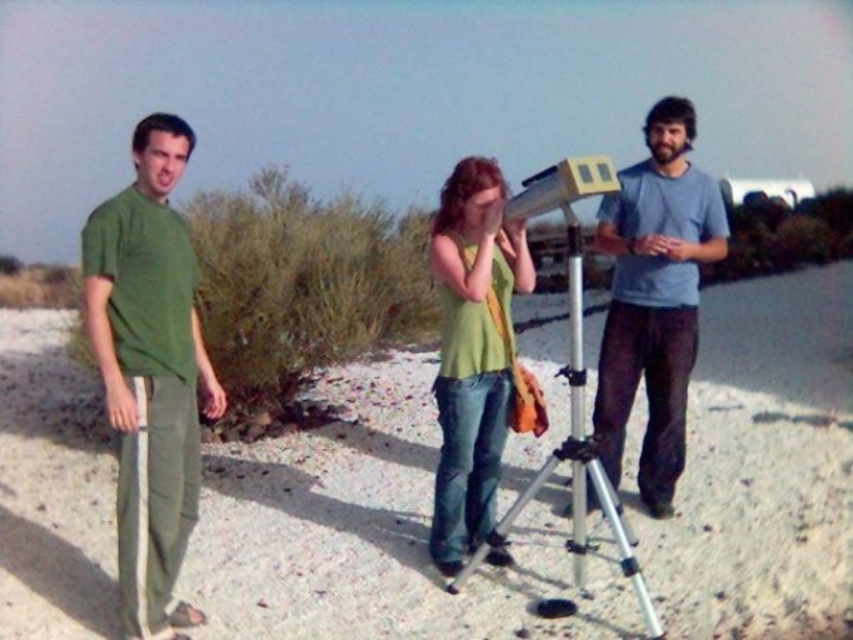
Identify the location of white sandy ground at center. (369, 532).

Does white sandy ground at center have a greater width compared to green cotton shirt at left?

Yes, white sandy ground at center is wider than green cotton shirt at left.

What do you see at coordinates (369, 532) in the screenshot? I see `white sandy ground at center` at bounding box center [369, 532].

Locate an element on the screen. Image resolution: width=853 pixels, height=640 pixels. white sandy ground at center is located at coordinates (369, 532).

Who is higher up, white sandy ground at center or green matte tank top at center?

green matte tank top at center

Is white sandy ground at center to the right of green matte tank top at center from the viewer's perspective?

Indeed, white sandy ground at center is positioned on the right side of green matte tank top at center.

Is point (549, 573) positioned behind point (436, 545)?

That is False.

This screenshot has width=853, height=640. I want to click on white sandy ground at center, so click(369, 532).

Is green cotton shirt at left thinner than light blue t-shirt at center?

Yes, green cotton shirt at left is thinner than light blue t-shirt at center.

Which is behind, point (117, 332) or point (634, 220)?

Positioned behind is point (634, 220).

Find the location of `green cotton shirt at left`. green cotton shirt at left is located at coordinates (149, 371).